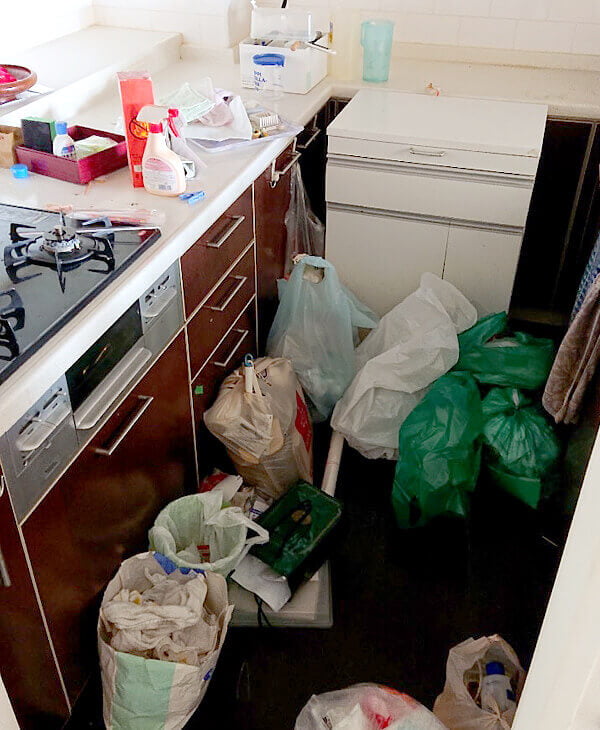
Image resolution: width=600 pixels, height=730 pixels. What are the coordinates of `clear blue jug` in the screenshot? It's located at (375, 47).